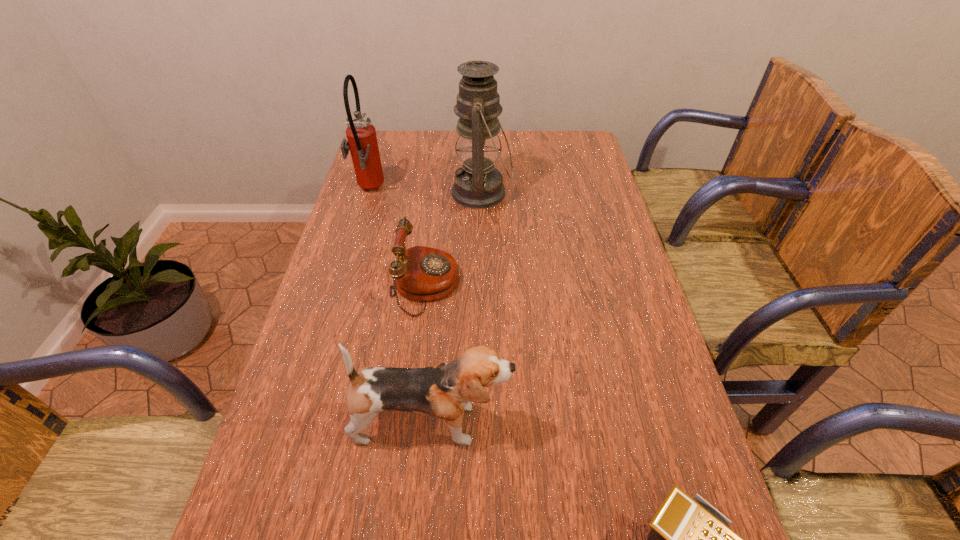
At what (x,y) coordinates should I click in order to perform the action: click on object located in the left edge section of the desktop. Please return your answer as a coordinate pair (x, y). This screenshot has height=540, width=960. Looking at the image, I should click on (361, 134).

This screenshot has width=960, height=540. I want to click on vacant space at the far edge of the desktop, so click(455, 157).

Identify the location of free spot at the left edge of the desktop. This screenshot has height=540, width=960. (315, 497).

Find the location of `vacant area at the right edge of the desktop`. vacant area at the right edge of the desktop is located at coordinates (x=575, y=185).

At what (x,y) coordinates should I click in order to perform the action: click on free region at the far right corner of the desktop. Please return your answer as a coordinate pair (x, y). Image resolution: width=960 pixels, height=540 pixels. Looking at the image, I should click on (571, 132).

Where is `free space that is in between the oil lamp and the fire extinguisher`? The height and width of the screenshot is (540, 960). free space that is in between the oil lamp and the fire extinguisher is located at coordinates (425, 192).

The width and height of the screenshot is (960, 540). Find the location of `vacant area that lies between the leftmost object and the third shortest object`. vacant area that lies between the leftmost object and the third shortest object is located at coordinates (400, 307).

Locate an element on the screen. This screenshot has width=960, height=540. object that is the closest to the leftmost object is located at coordinates (477, 184).

Image resolution: width=960 pixels, height=540 pixels. Identify the location of object that can be found as the fourth closest to the second shortest object. (690, 539).

Identify the location of free space that satisfies the following two spatial constraints: 1. on the front side of the oil lamp; 2. on the dial of the second shortest object. The height and width of the screenshot is (540, 960). (482, 286).